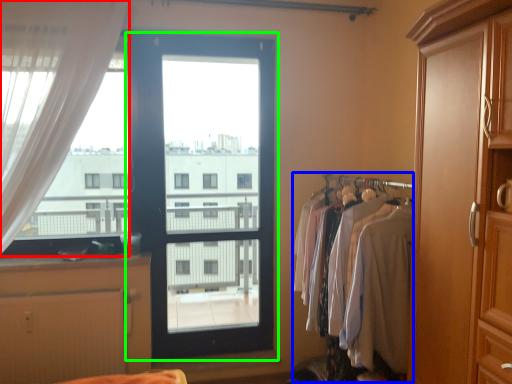
Question: Based on their relative distances, which object is nearer to curtain (highlighted by a red box)? Choose from laundry (highlighted by a blue box) and door (highlighted by a green box).

Choices:
 (A) laundry
 (B) door

Answer: (A)